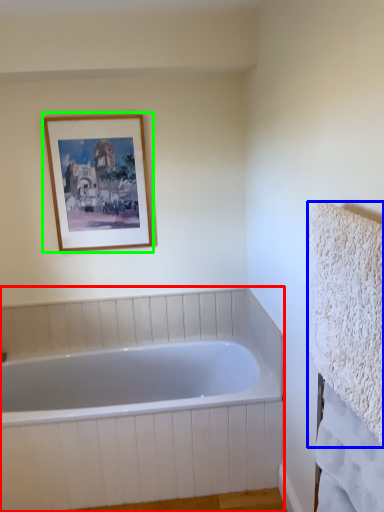
Question: Which object is positioned closest to bathtub (highlighted by a red box)? Select from bath towel (highlighted by a blue box) and picture frame (highlighted by a green box).

Choices:
 (A) bath towel
 (B) picture frame

Answer: (B)